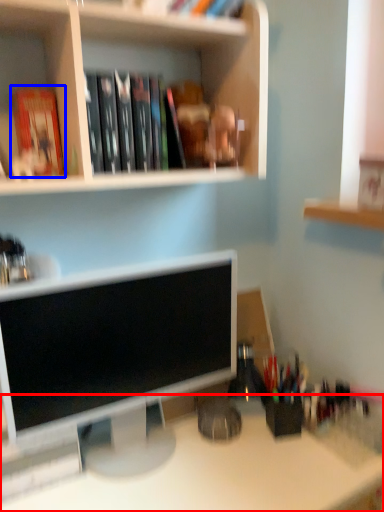
Question: Among these objects, which one is nearest to the camera, desk (highlighted by a red box) or paperback book (highlighted by a blue box)?

Choices:
 (A) desk
 (B) paperback book

Answer: (A)